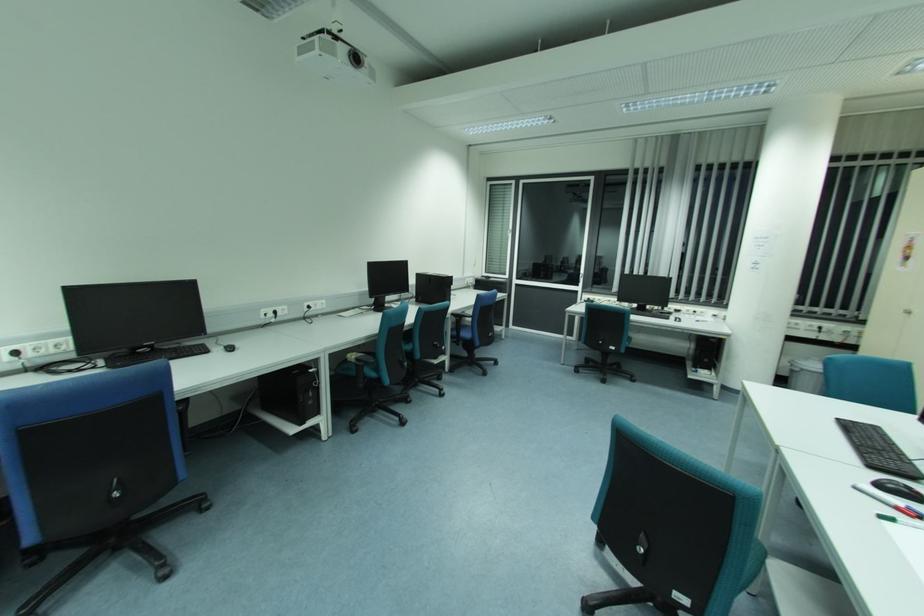
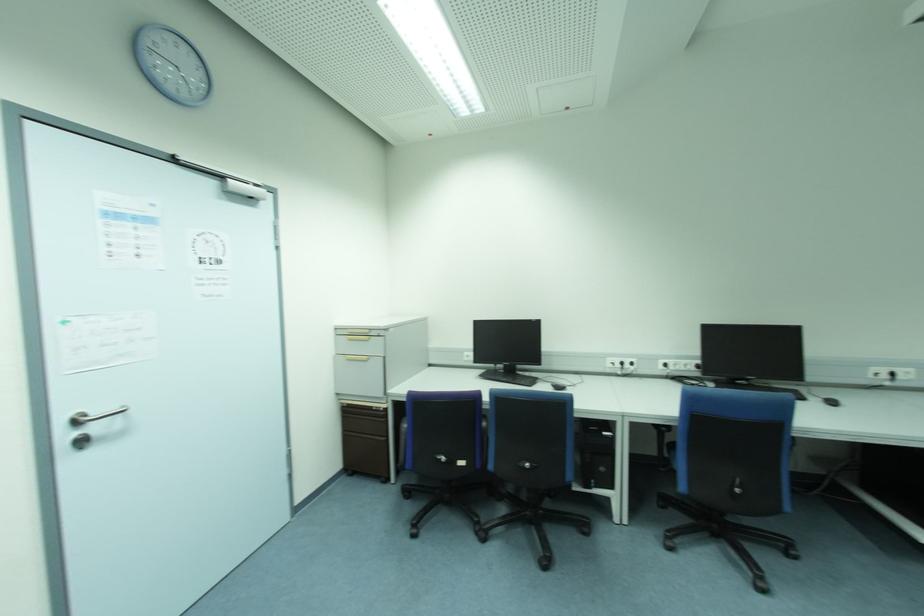
Question: How did the camera likely rotate?

Choices:
 (A) Left
 (B) Right
 (C) Up
 (D) Down

Answer: (A)